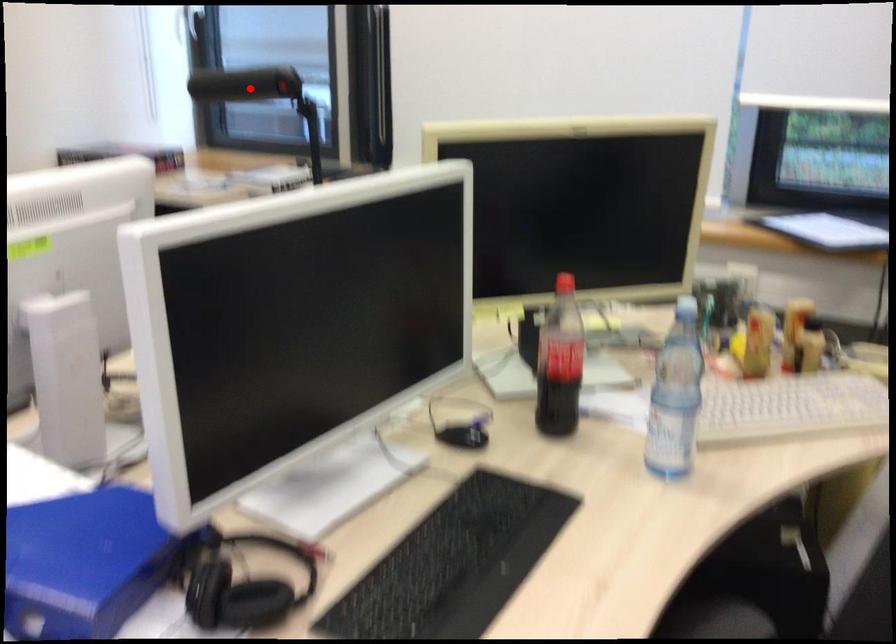
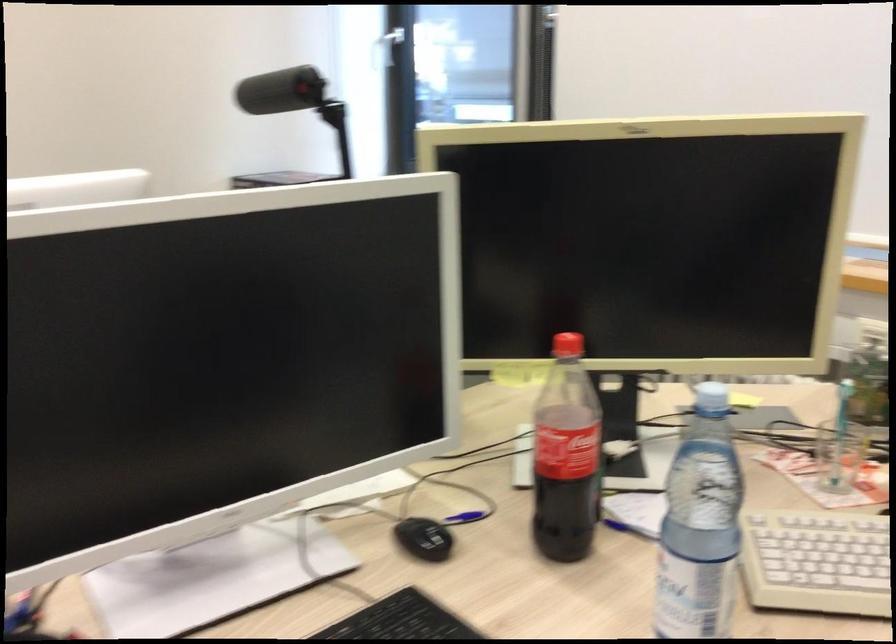
The point at the highlighted location is marked in the first image. Where is the corresponding point in the second image?

(280, 91)